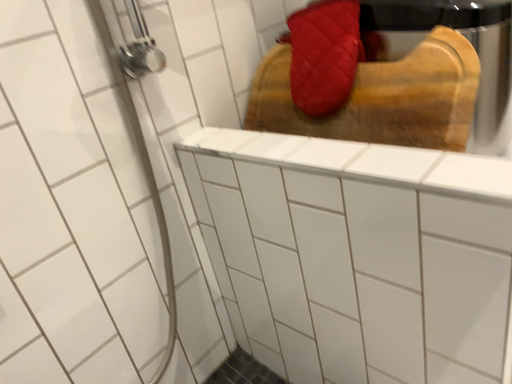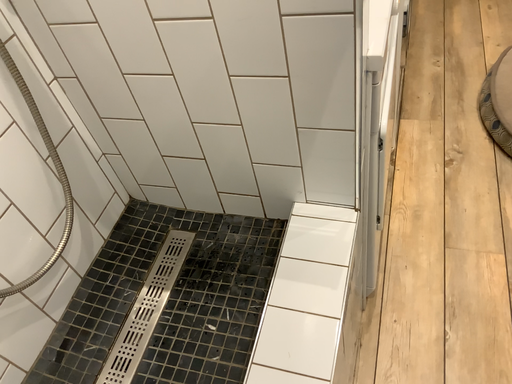
Question: How did the camera likely rotate when shooting the video?

Choices:
 (A) rotated left
 (B) rotated right

Answer: (B)